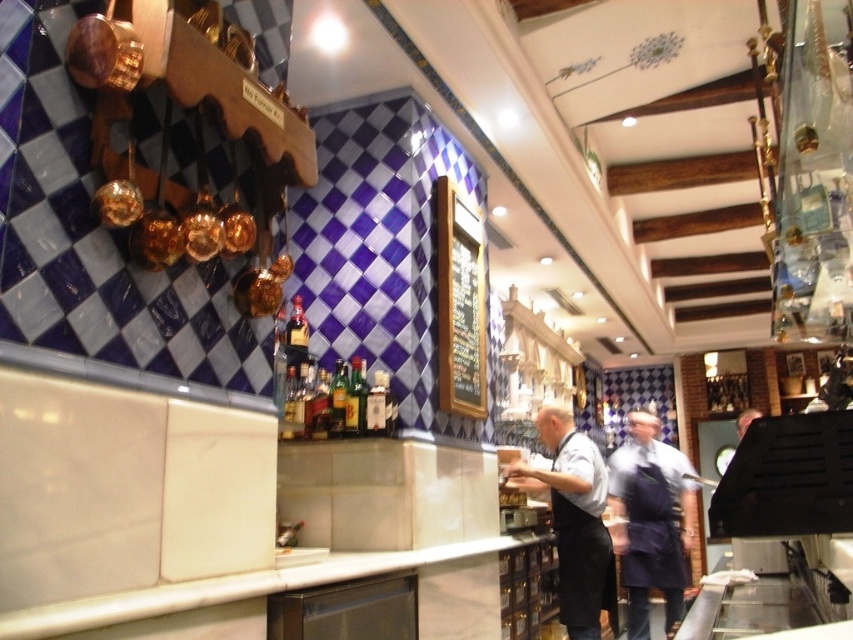
This screenshot has height=640, width=853. Find the location of `dark blue apron at center`. dark blue apron at center is located at coordinates (650, 522).

Which of these two, dark blue apron at center or white marble counter at center, stands taller?

dark blue apron at center is taller.

Which is in front, point (648, 630) or point (120, 602)?

Point (120, 602) is in front.

Locate an element on the screen. dark blue apron at center is located at coordinates (650, 522).

What do you see at coordinates (231, 588) in the screenshot? I see `white marble counter at center` at bounding box center [231, 588].

Does white marble counter at center appear on the right side of black apron at center?

Incorrect, white marble counter at center is not on the right side of black apron at center.

Which is behind, point (91, 602) or point (601, 548)?

The point (601, 548) is more distant.

Where is `white marble counter at center`? The width and height of the screenshot is (853, 640). white marble counter at center is located at coordinates pos(231,588).

Based on the photo, does dark blue apron at center appear over black apron at center?

No.

Is dark blue apron at center below black apron at center?

Correct, dark blue apron at center is located below black apron at center.

Which is in front, point (668, 586) or point (595, 611)?

Positioned in front is point (595, 611).

The width and height of the screenshot is (853, 640). I want to click on dark blue apron at center, so click(650, 522).